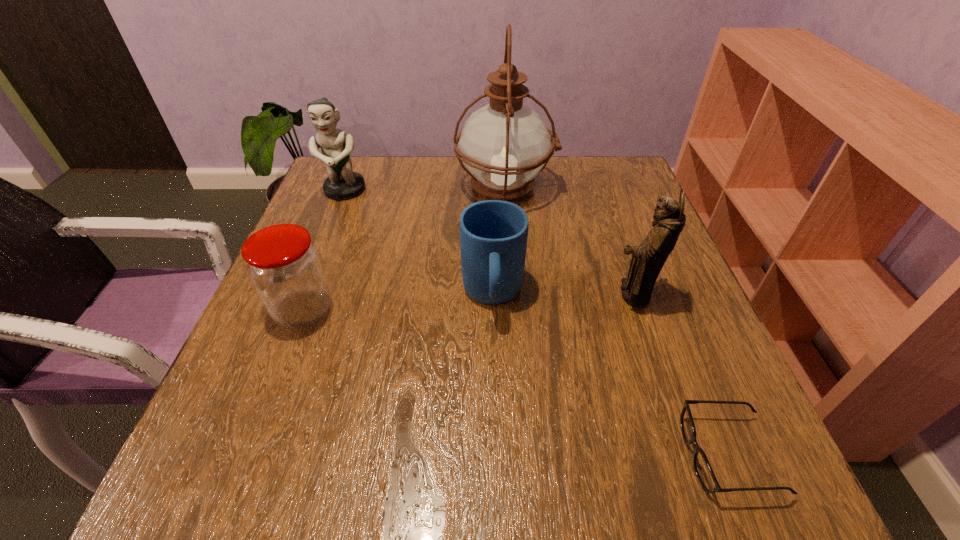
Where is `the closest object to the nearer figurine`? The height and width of the screenshot is (540, 960). the closest object to the nearer figurine is located at coordinates (493, 233).

The width and height of the screenshot is (960, 540). In order to click on object that is the third closest to the oil lamp in this screenshot , I will do `click(342, 184)`.